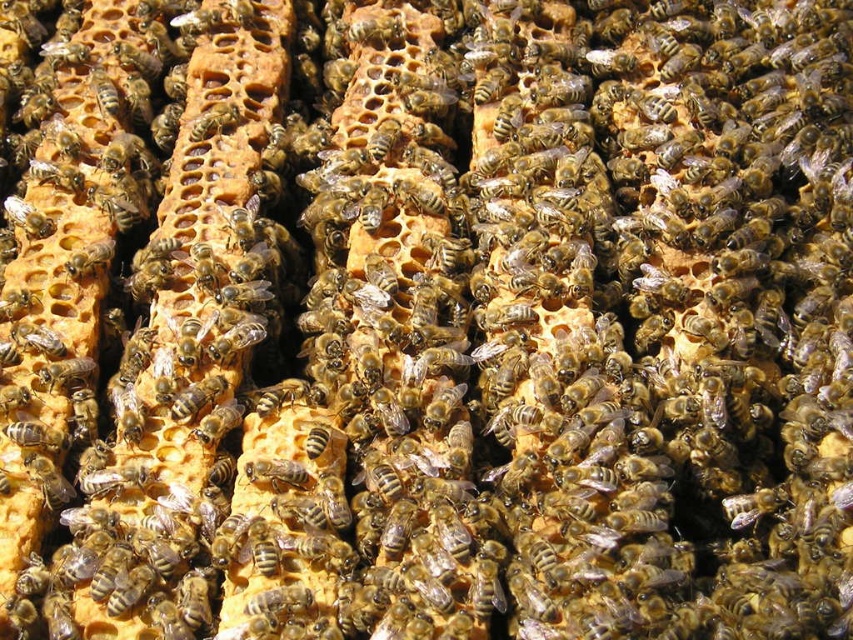
Does brown fuzzy bee at center have a lesser width compared to translucent golden honeycomb at upper left?

Yes, brown fuzzy bee at center is thinner than translucent golden honeycomb at upper left.

The height and width of the screenshot is (640, 853). Describe the element at coordinates (276, 472) in the screenshot. I see `brown fuzzy bee at center` at that location.

Find the location of a particular element. The width and height of the screenshot is (853, 640). brown fuzzy bee at center is located at coordinates (276, 472).